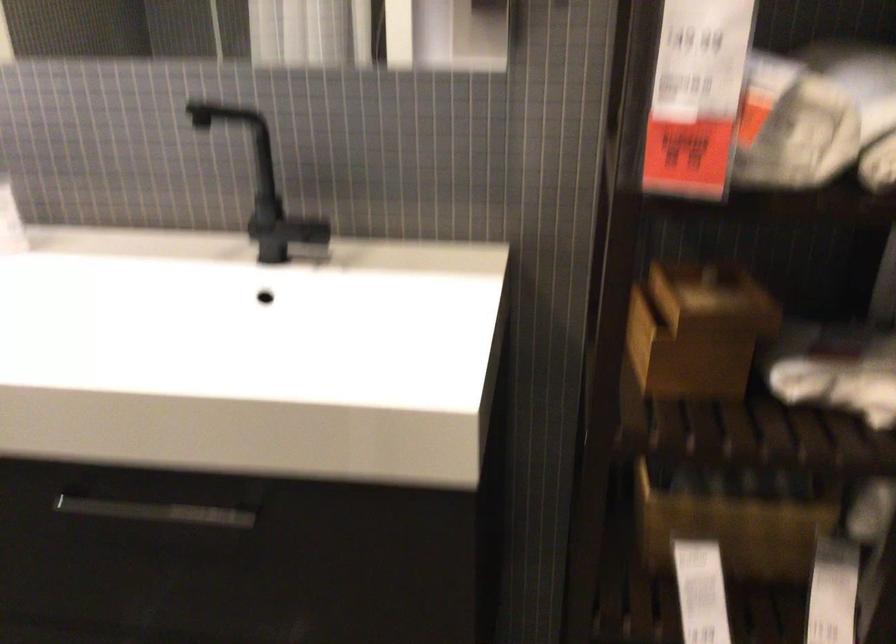
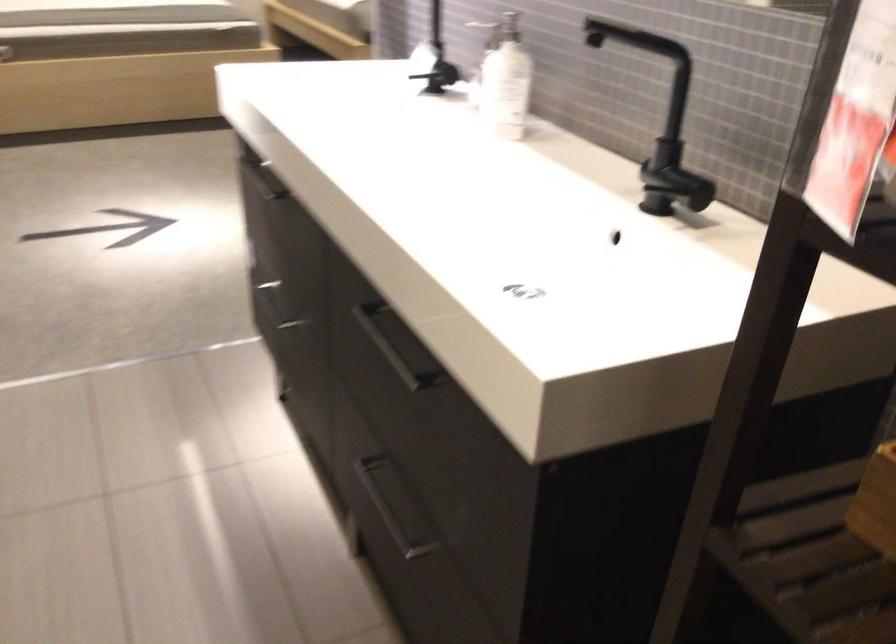
Question: How did the camera likely rotate?

Choices:
 (A) Left
 (B) Right
 (C) Up
 (D) Down

Answer: (A)